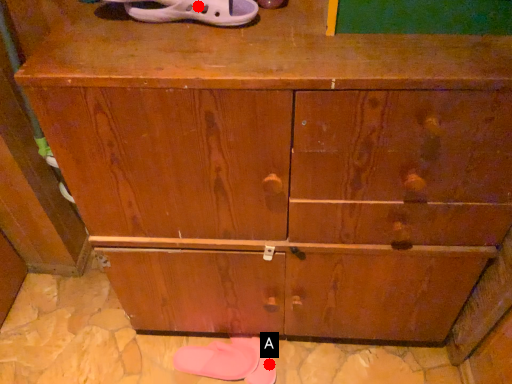
Question: Two points are circled on the image, labeled by A and B beside each circle. Which point is farther to the camera?

Choices:
 (A) A is further
 (B) B is further

Answer: (A)